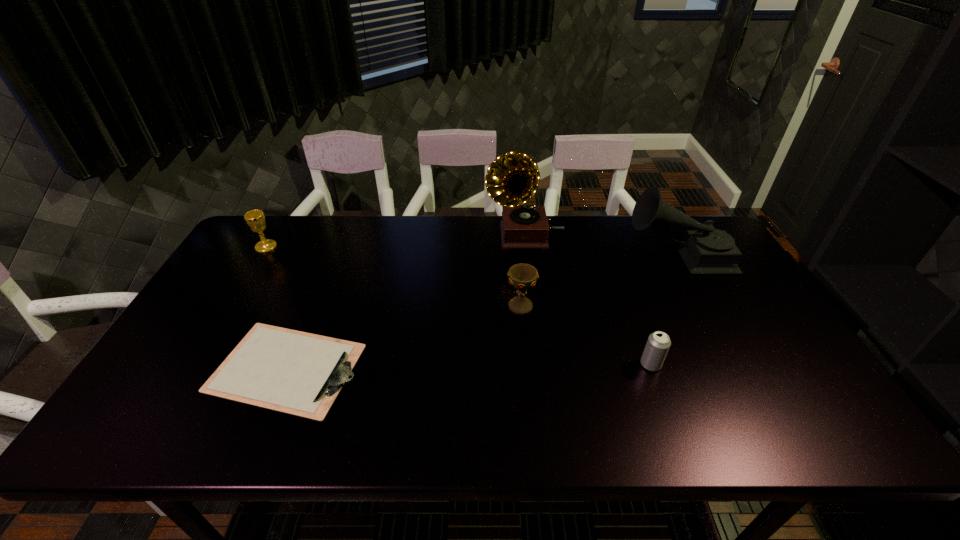
Where is `vacant space at the far edge of the desktop`? This screenshot has height=540, width=960. vacant space at the far edge of the desktop is located at coordinates (406, 253).

The height and width of the screenshot is (540, 960). In the image, there is a desktop. What are the coordinates of `vacant area at the right edge` in the screenshot? It's located at (747, 297).

In the image, there is a desktop. Identify the location of vacant space at the far left corner. The width and height of the screenshot is (960, 540). (241, 255).

Identify the location of vacant area at the near left corner of the desktop. This screenshot has width=960, height=540. (127, 440).

This screenshot has width=960, height=540. In order to click on vacant region at the far right corner of the desktop in this screenshot , I will do `click(684, 230)`.

Identify the location of empty location between the tallest object and the shorter phonograph_record. [601, 245].

Image resolution: width=960 pixels, height=540 pixels. In order to click on free space between the shortest object and the right chalice in this screenshot , I will do `click(403, 338)`.

The image size is (960, 540). In order to click on free area in between the shorter phonograph_record and the taller phonograph_record in this screenshot , I will do `click(601, 245)`.

Image resolution: width=960 pixels, height=540 pixels. I want to click on empty location between the fifth object from left to right and the rightmost object, so click(x=664, y=310).

Find the location of a particular element. This screenshot has width=960, height=540. vacant space that is in between the beer can and the farther chalice is located at coordinates (458, 306).